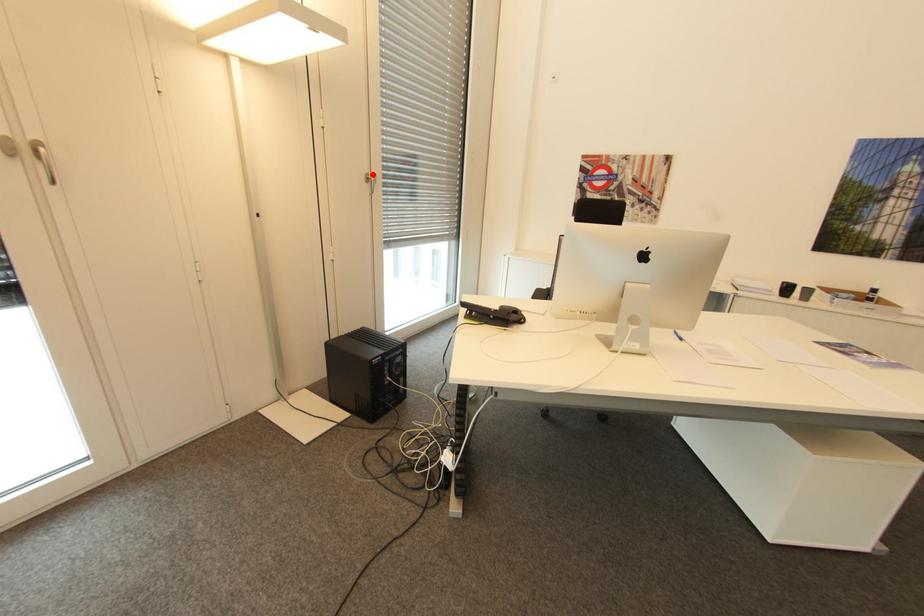
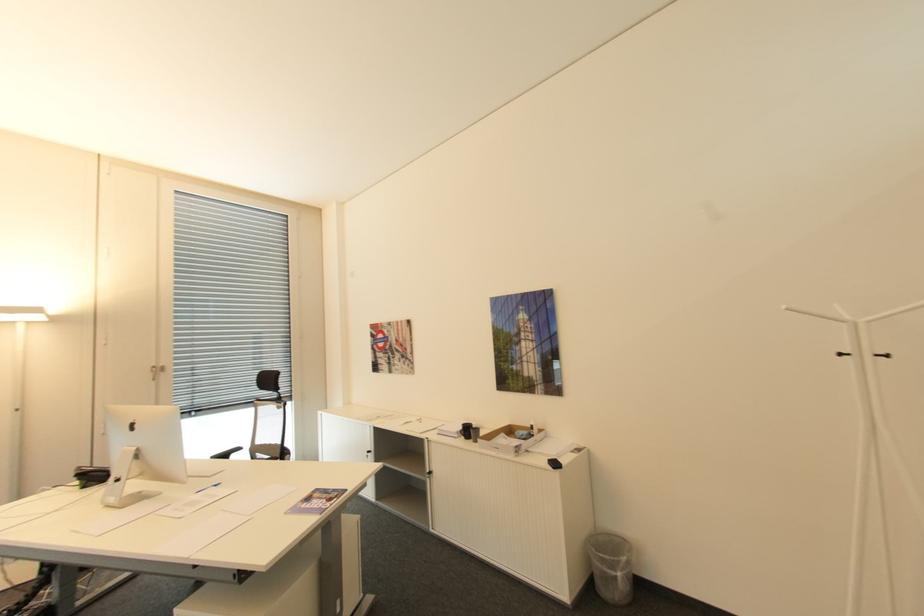
Question: I am providing you with two images of the same scene from different viewpoints. A red point is shown in image1. For the corresponding object point in image2, is it positioned nearer or farther from the camera?

Choices:
 (A) Nearer
 (B) Farther

Answer: (B)